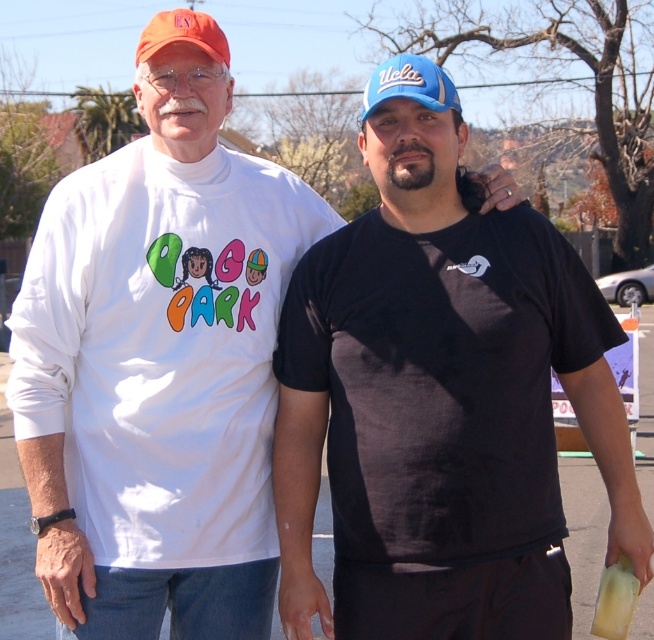
What is the object located at the coordinates point (409,84) in the image?

The object at point (409,84) is the blue fabric baseball cap at upper center.